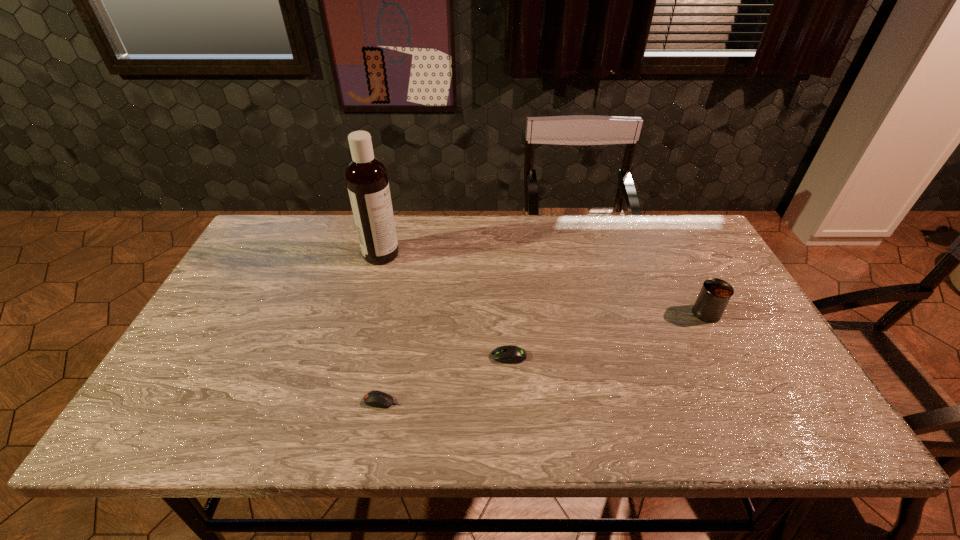
I want to click on vacant space located on the wheel side of the right computer mouse, so click(x=429, y=356).

Find the location of `vacant space located on the wheel side of the right computer mouse`. vacant space located on the wheel side of the right computer mouse is located at coordinates (434, 356).

Locate an element on the screen. The width and height of the screenshot is (960, 540). free space located 0.340m on the wheel side of the right computer mouse is located at coordinates (351, 356).

Locate an element on the screen. vacant space located 0.130m on the left of the nearest object is located at coordinates (305, 401).

The width and height of the screenshot is (960, 540). I want to click on object that is at the far edge, so click(366, 177).

You are a GUI agent. You are given a task and a screenshot of the screen. Output one action in this format:
    pyautogui.click(x=<x>, y=<y>)
    Task: Click on the object present at the near edge
    This screenshot has width=960, height=540.
    Given the screenshot: What is the action you would take?
    (x=375, y=398)

The height and width of the screenshot is (540, 960). I want to click on object that is at the right edge, so coord(715,294).

The height and width of the screenshot is (540, 960). In the image, there is a desktop. What are the coordinates of `free space at the far edge` in the screenshot? It's located at (496, 258).

This screenshot has width=960, height=540. Identify the location of free space at the near edge of the desktop. (463, 437).

Identify the location of vacant space at the left edge. (207, 346).